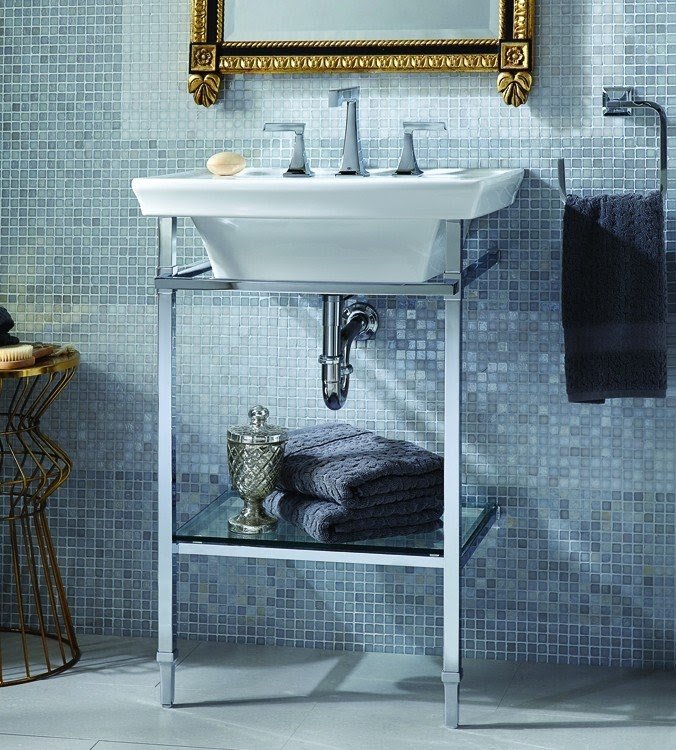
This screenshot has width=676, height=750. In order to click on mirror in this screenshot , I will do `click(432, 33)`.